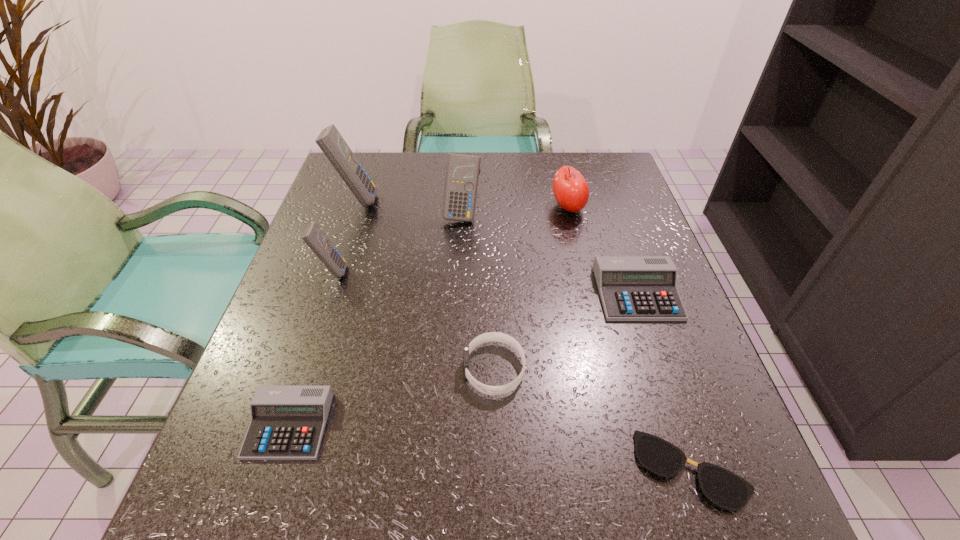
Locate an element on the screen. the tallest object is located at coordinates (330, 141).

You are a GUI agent. You are given a task and a screenshot of the screen. Output one action in this format:
    pyautogui.click(x=<x>, y=<y>)
    Task: Click on the biggest blue calculator
    The width and height of the screenshot is (960, 540).
    Given the screenshot: What is the action you would take?
    pyautogui.click(x=330, y=141)

The height and width of the screenshot is (540, 960). Identify the location of the second tallest object. (462, 172).

Locate an element on the screen. This screenshot has height=540, width=960. the second tallest calculator is located at coordinates (462, 172).

The height and width of the screenshot is (540, 960). What are the coordinates of `the third shortest calculator` in the screenshot? It's located at (313, 236).

Image resolution: width=960 pixels, height=540 pixels. Identify the location of the nearest blue calculator. (313, 236).

Where is `apple`? apple is located at coordinates (571, 191).

Locate an element on the screen. This screenshot has height=540, width=960. the right gray calculator is located at coordinates (632, 288).

At what (x,y) coordinates should I click in order to perform the action: click on the bigger gray calculator. Please return your answer as a coordinate pair (x, y). Looking at the image, I should click on (632, 288).

Where is `wristband`? The height and width of the screenshot is (540, 960). wristband is located at coordinates (490, 336).